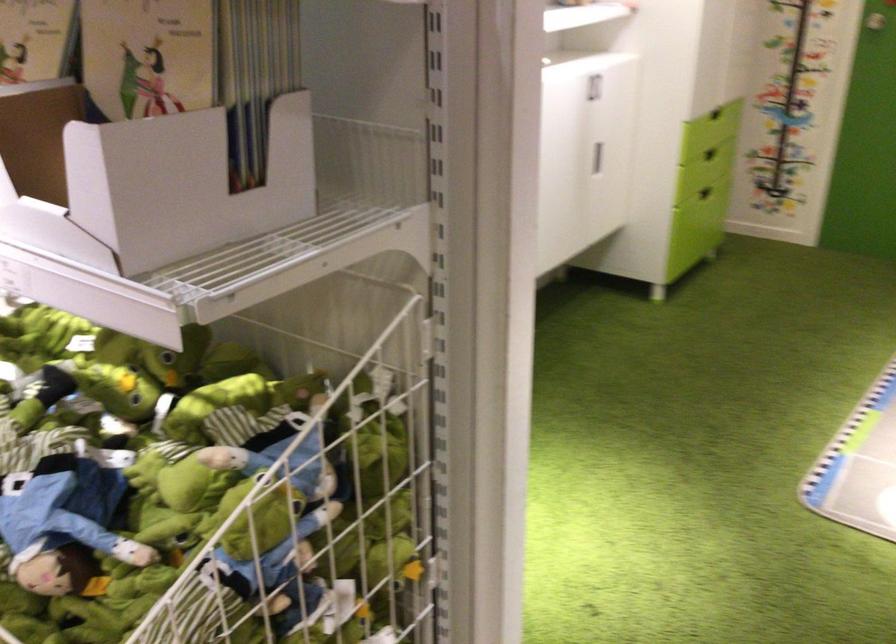
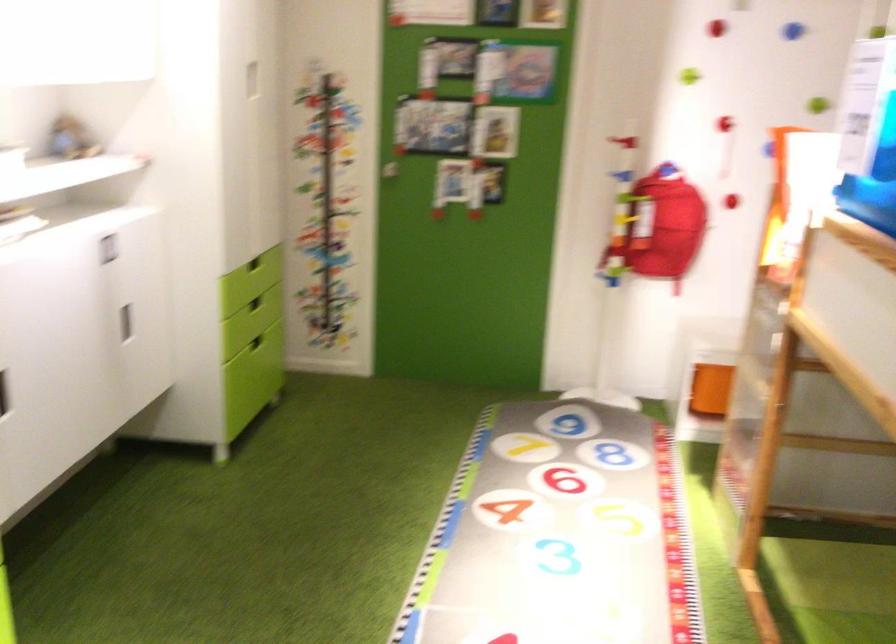
Locate, in the second image, the point that corresponds to [718,149] in the first image.

(254, 303)